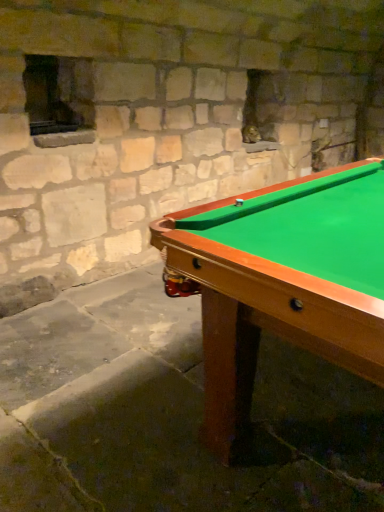
Locate an element on the screen. green felt pool table at center is located at coordinates click(282, 281).

What do you see at coordinates (282, 281) in the screenshot? I see `green felt pool table at center` at bounding box center [282, 281].

You are a GUI agent. You are given a task and a screenshot of the screen. Output one action in this format:
    pyautogui.click(x=<x>, y=<y>)
    Task: Click on the green felt pool table at center
    The height and width of the screenshot is (512, 384).
    Given the screenshot: What is the action you would take?
    pyautogui.click(x=282, y=281)